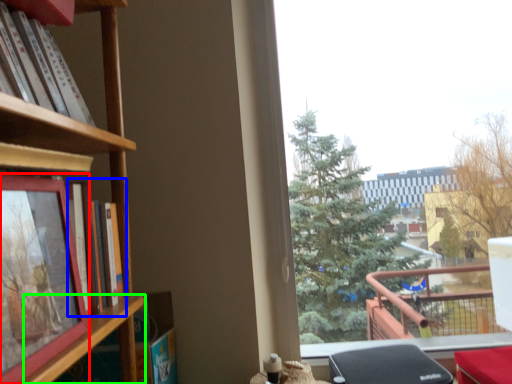
Question: Considering the real-world distances, which object is farthest from picture frame (highlighted by a red box)? book (highlighted by a blue box) or shelf (highlighted by a green box)?

Choices:
 (A) book
 (B) shelf

Answer: (A)